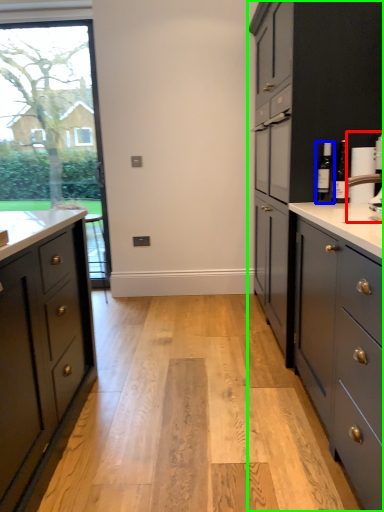
Question: Considering the real-world distances, which object is farthest from coffee machine (highlighted by a red box)? bottle (highlighted by a blue box) or cabinetry (highlighted by a green box)?

Choices:
 (A) bottle
 (B) cabinetry

Answer: (B)